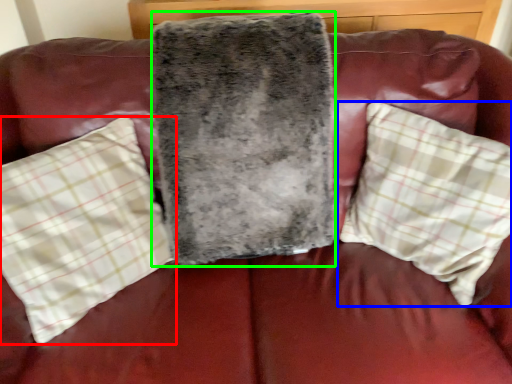
Question: Based on their relative distances, which object is nearer to pillow (highlighted by a red box)? Choose from pillow (highlighted by a blue box) and blanket (highlighted by a green box).

Choices:
 (A) pillow
 (B) blanket

Answer: (B)